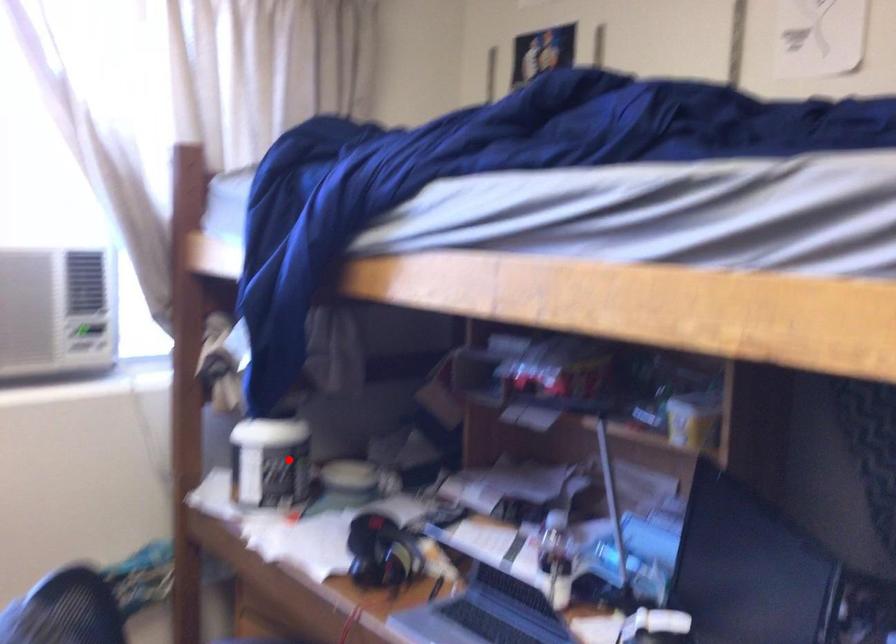
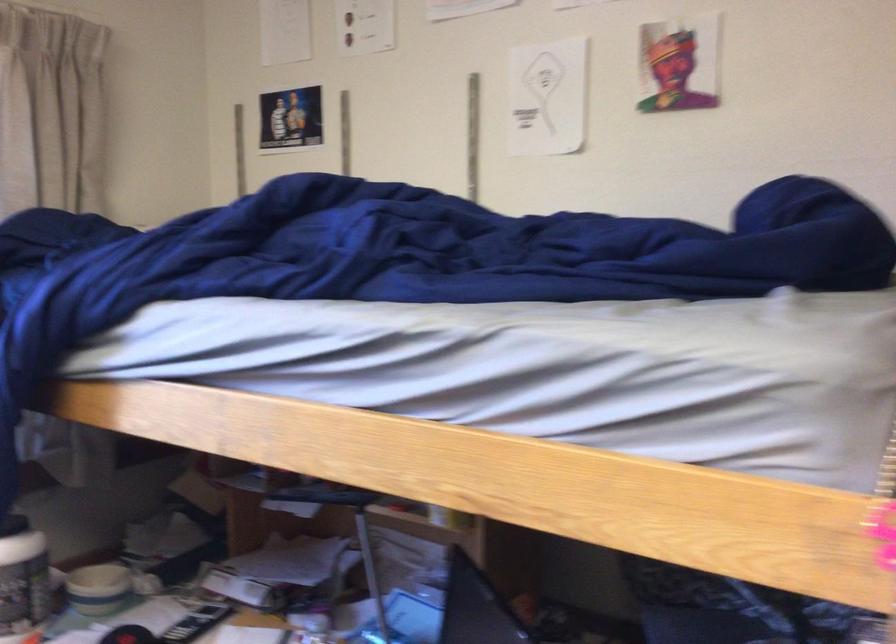
Locate, in the second image, the point that corresponds to the highlighted location in the first image.

(22, 581)